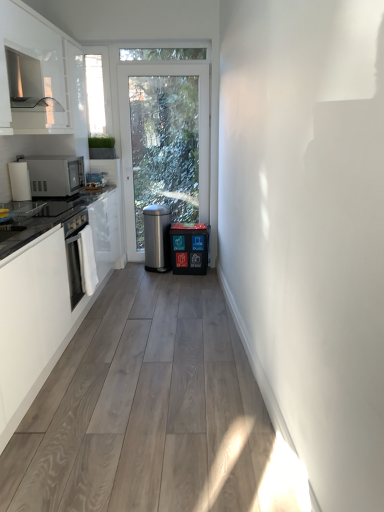
The width and height of the screenshot is (384, 512). What are the coordinates of `free location to the left of polished stainless steel trash can at center` in the screenshot? It's located at (129, 265).